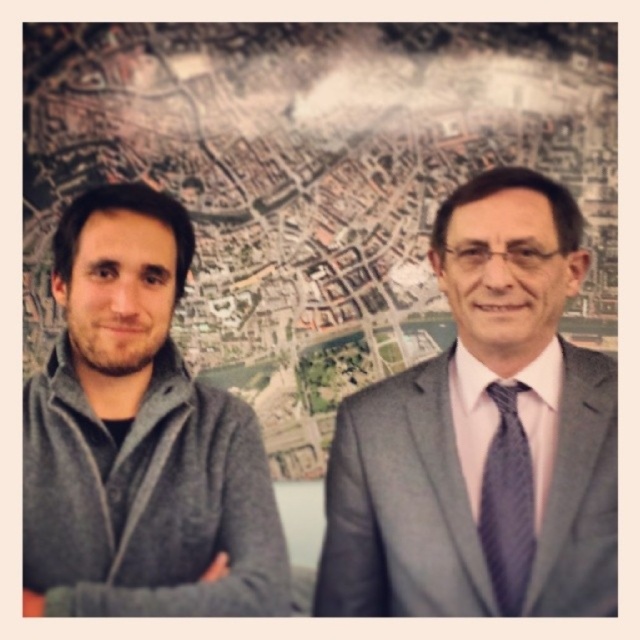
Looking at this image, you are a tailor trying to determine which item requires more fabric to make between the gray fleece jacket at left and the dark gray textured tie at right. Which one would need more fabric?

The gray fleece jacket at left requires more fabric because its width is larger than the dark gray textured tie at right.

You are a photographer setting up a shoot for a magazine cover. The scene requires the model in the matte gray suit at right to be positioned higher than the model in the gray fleece jacket at left. Based on the current arrangement shown in the image, is this requirement already met?

The matte gray suit at right is located below the gray fleece jacket at left, so the requirement for the matte gray suit at right to be positioned higher than the gray fleece jacket at left is not met. Adjust their positions accordingly.